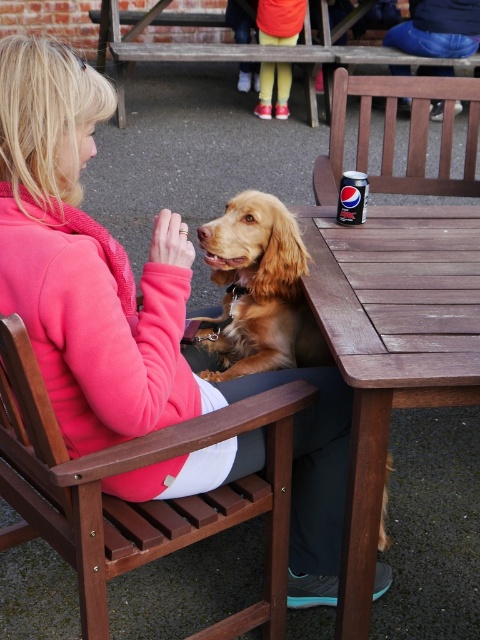
Question: From the image, what is the correct spatial relationship of pink fleece jacket at center in relation to golden brown fur at center?

Choices:
 (A) right
 (B) left

Answer: (B)

Question: Can you confirm if pink fleece jacket at center is wider than golden brown fur at center?

Choices:
 (A) no
 (B) yes

Answer: (B)

Question: Is brown wooden table at center further to camera compared to golden brown fur at center?

Choices:
 (A) no
 (B) yes

Answer: (A)

Question: Which object is the closest to the brown wooden table at center?

Choices:
 (A) pink fleece jacket at center
 (B) golden brown fur at center

Answer: (B)

Question: Which of the following is the closest to the observer?

Choices:
 (A) golden brown fur at center
 (B) pink fleece jacket at center
 (C) brown wooden table at center

Answer: (B)

Question: Which point is farther from the camera taking this photo?

Choices:
 (A) (238, 216)
 (B) (241, 384)

Answer: (A)